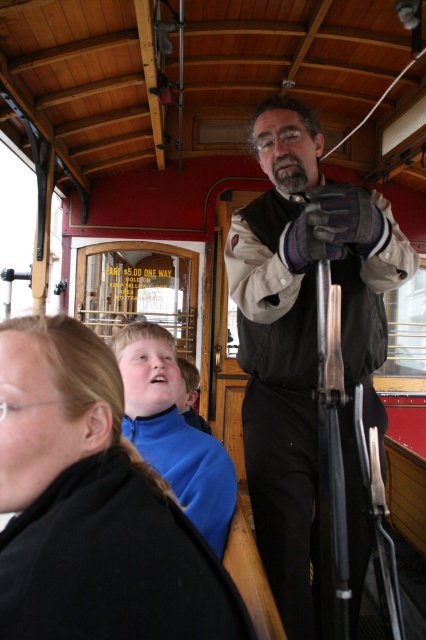
You are a photographer standing in the vintage streetcar. You want to take a photo of the black fabric jacket at lower left without including yourself in the shot. Can you step back enough to do this?

The black fabric jacket at lower left and viewer are 23.59 inches apart. Since 23.59 inches is about 2 feet, stepping back a few more feet would allow you to capture the jacket without being in the frame.

You are a tailor who needs to determine which item requires more fabric to alter between the black fabric jacket at lower left and the matte black vest at center. Based on their sizes, which one would need more fabric?

The matte black vest at center requires more fabric because it is larger in size compared to the black fabric jacket at lower left.

You are a passenger on this vintage streetcar and you need to reach the matte black vest at center to ask for directions. There is a black fabric jacket at lower left in your way. Which object should you move first to get to the vest?

You should move the black fabric jacket at lower left first because it is positioned to the left of the matte black vest at center, blocking the path.